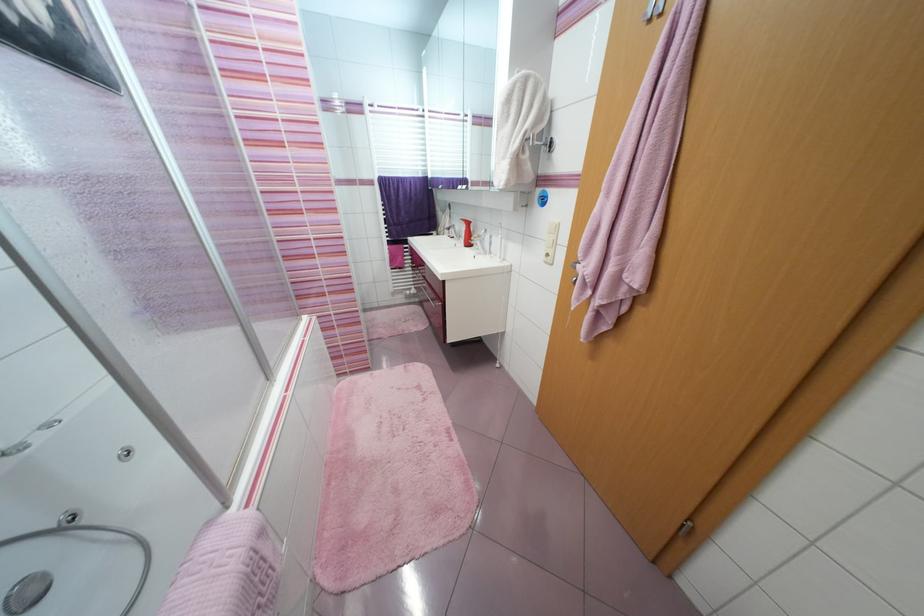
Find the location of a particular element. The image size is (924, 616). white toothbrush holder is located at coordinates (464, 286).